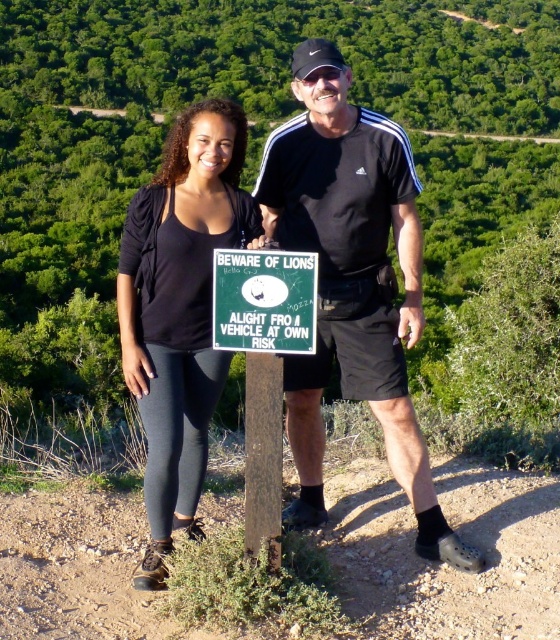
Does black fabric top at center appear on the left side of green plastic sign at center?

Correct, you'll find black fabric top at center to the left of green plastic sign at center.

Is point (164, 538) closer to viewer compared to point (276, 275)?

That is False.

Where is `black fabric top at center`? black fabric top at center is located at coordinates (179, 310).

Who is positioned more to the right, black matte shorts at center or green plastic sign at center?

black matte shorts at center

Which is behind, point (410, 483) or point (304, 272)?

Positioned behind is point (410, 483).

Who is more distant from viewer, (286, 154) or (290, 259)?

The point (286, 154) is behind.

I want to click on black matte shorts at center, so click(x=352, y=282).

Which is above, black matte shorts at center or black fabric top at center?

black matte shorts at center is above.

What are the coordinates of `black matte shorts at center` in the screenshot? It's located at (352, 282).